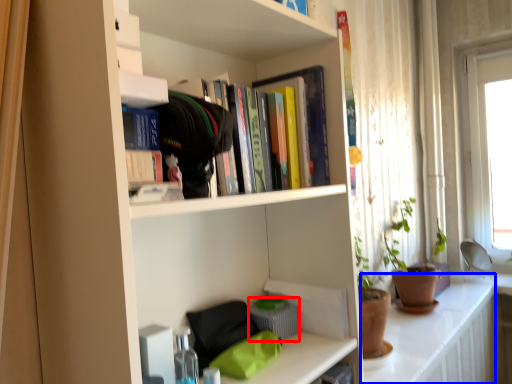
Question: Among these objects, which one is farthest to the camera, basket (highlighted by a red box) or counter top (highlighted by a blue box)?

Choices:
 (A) basket
 (B) counter top

Answer: (B)